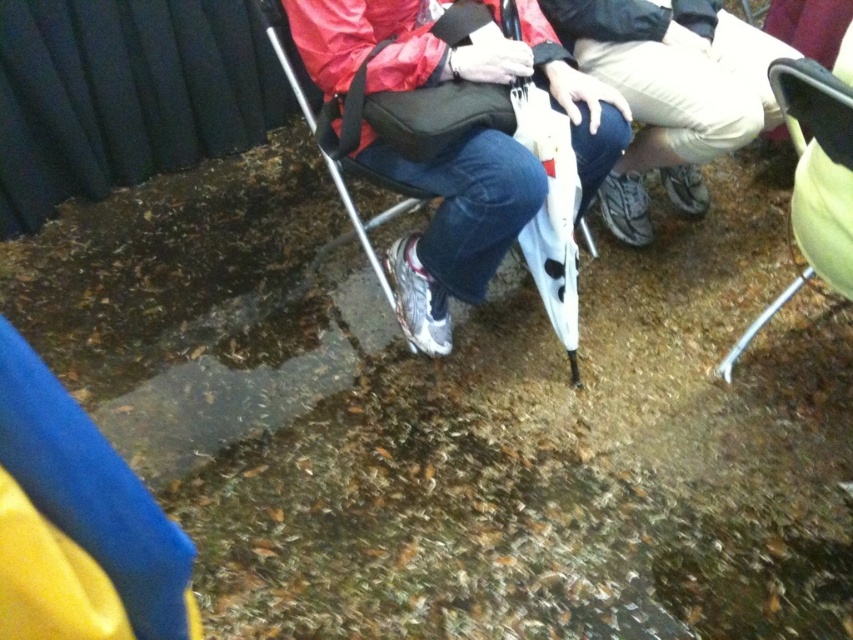
Question: Is metallic silver chair at center smaller than green fabric folding chair at right?

Choices:
 (A) yes
 (B) no

Answer: (B)

Question: Which object appears farthest from the camera in this image?

Choices:
 (A) green fabric folding chair at right
 (B) khaki cotton pants at center
 (C) metallic silver chair at center

Answer: (B)

Question: Which of the following is the closest to the observer?

Choices:
 (A) green fabric folding chair at right
 (B) khaki cotton pants at center

Answer: (A)

Question: Is khaki cotton pants at center to the left of metallic silver chair at center from the viewer's perspective?

Choices:
 (A) no
 (B) yes

Answer: (A)

Question: Which object is positioned closest to the khaki cotton pants at center?

Choices:
 (A) metallic silver chair at center
 (B) green fabric folding chair at right

Answer: (B)

Question: Does metallic silver chair at center appear on the left side of green fabric folding chair at right?

Choices:
 (A) yes
 (B) no

Answer: (A)